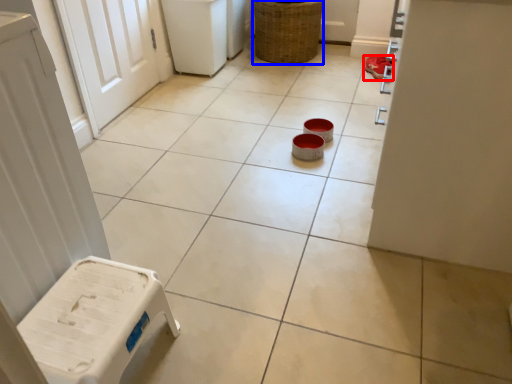
Question: Which point is closer to the camera, footwear (highlighted by a red box) or basket (highlighted by a blue box)?

Choices:
 (A) footwear
 (B) basket

Answer: (B)